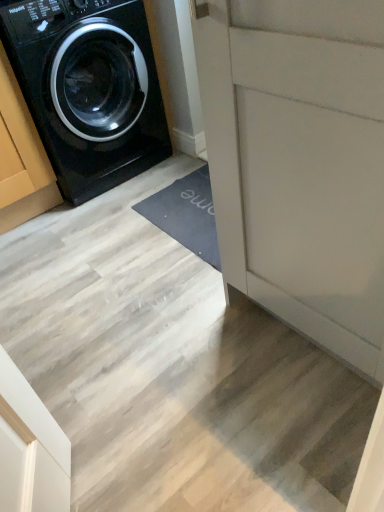
This screenshot has width=384, height=512. Describe the element at coordinates (88, 88) in the screenshot. I see `black glossy washing machine at left` at that location.

Find the location of a particular element. The height and width of the screenshot is (512, 384). black glossy washing machine at left is located at coordinates (88, 88).

Find the location of a particular element. Image resolution: width=384 pixels, height=512 pixels. black glossy washing machine at left is located at coordinates (88, 88).